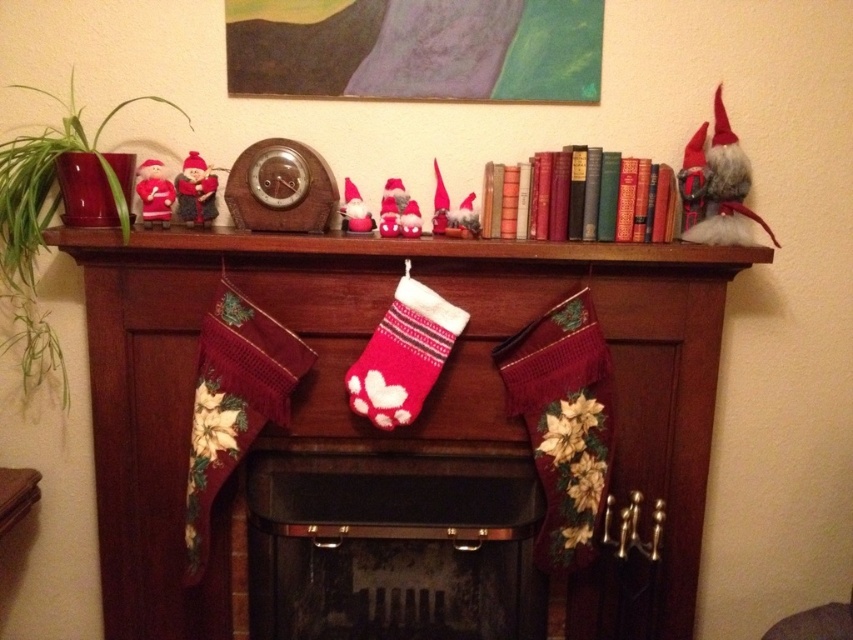
Who is positioned more to the left, knitted stockings at center or matte purple painting at upper center?

Positioned to the left is knitted stockings at center.

Does knitted stockings at center appear over matte purple painting at upper center?

Actually, knitted stockings at center is below matte purple painting at upper center.

What are the coordinates of `knitted stockings at center` in the screenshot? It's located at (355, 356).

Is knitted stockings at center bigger than knitted wool stockings at center?

Yes, knitted stockings at center is bigger than knitted wool stockings at center.

Between knitted stockings at center and knitted wool stockings at center, which one has less height?

With less height is knitted wool stockings at center.

At what (x,y) coordinates should I click in order to perform the action: click on knitted stockings at center. Please return your answer as a coordinate pair (x, y). The height and width of the screenshot is (640, 853). Looking at the image, I should click on (355, 356).

Can you confirm if black metal fireplace at center is thinner than knitted wool stockings at center?

Indeed, black metal fireplace at center has a lesser width compared to knitted wool stockings at center.

Is black metal fireplace at center closer to the viewer compared to knitted wool stockings at center?

No, it is behind knitted wool stockings at center.

What are the coordinates of `black metal fireplace at center` in the screenshot? It's located at (393, 547).